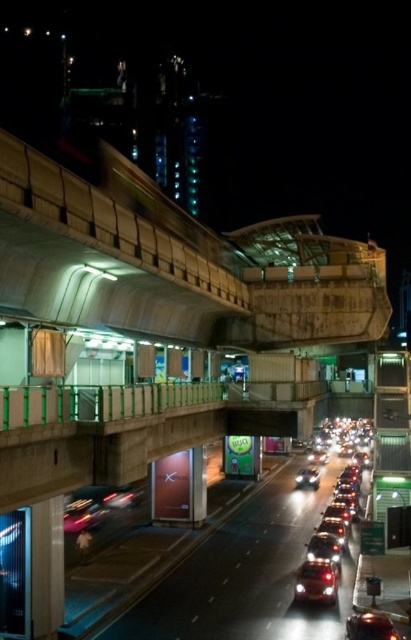
Looking at this image, you are a photographer taking a picture of the urban scene. You notice two points in your frame at coordinates point [327,486] and point [332,572]. Which point is closer to your camera lens?

Point [327,486] is further to the camera than point [332,572], so the point closer to the camera lens is point [332,572].